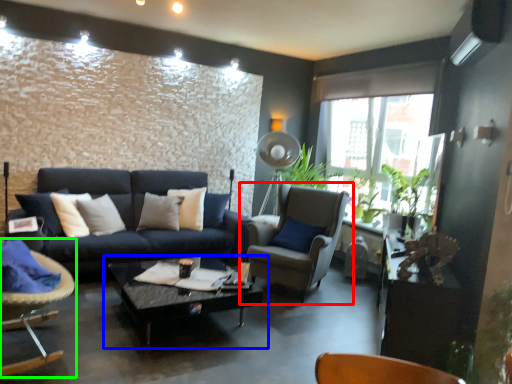
Question: Based on their relative distances, which object is farther from chair (highlighted by a red box)? Choose from coffee table (highlighted by a blue box) and chair (highlighted by a green box).

Choices:
 (A) coffee table
 (B) chair

Answer: (B)